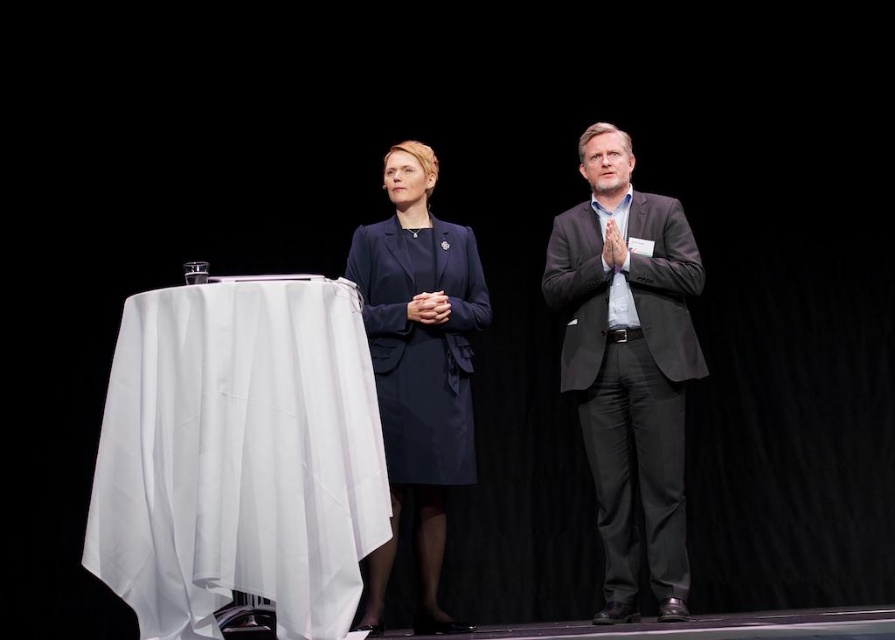
Question: Can you confirm if white cloth-covered table at left is positioned above dark gray suit at center?

Choices:
 (A) no
 (B) yes

Answer: (A)

Question: Which of the following is the closest to the observer?

Choices:
 (A) (696, 282)
 (B) (422, 433)
 (C) (111, 554)

Answer: (C)

Question: Observing the image, what is the correct spatial positioning of white cloth-covered table at left in reference to navy blue fabric coat at center?

Choices:
 (A) left
 (B) right

Answer: (A)

Question: Which object is closer to the camera taking this photo?

Choices:
 (A) white cloth-covered table at left
 (B) navy blue fabric coat at center
 (C) dark gray suit at center

Answer: (A)

Question: Does white cloth-covered table at left appear on the left side of dark gray suit at center?

Choices:
 (A) yes
 (B) no

Answer: (A)

Question: Based on their relative distances, which object is nearer to the white cloth-covered table at left?

Choices:
 (A) navy blue fabric coat at center
 (B) dark gray suit at center

Answer: (A)